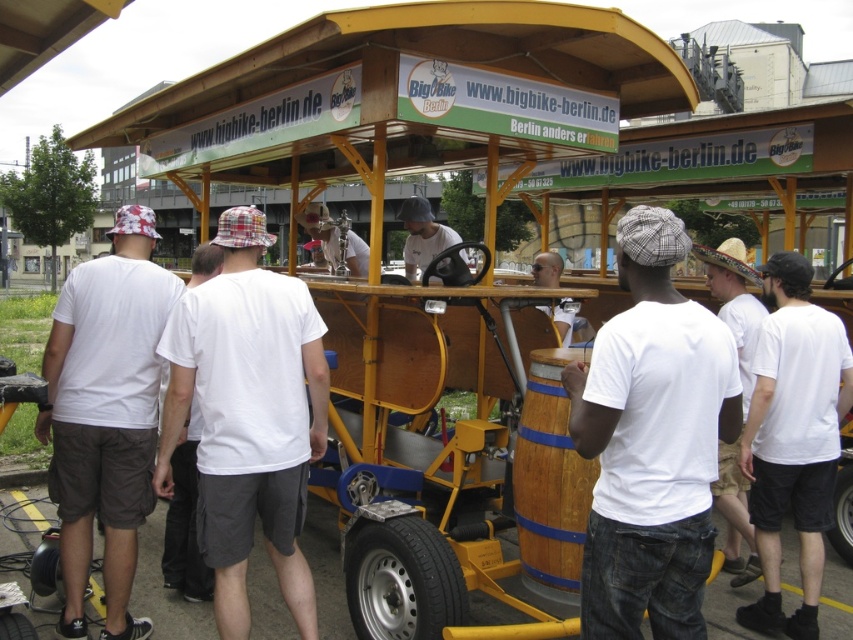
Question: Can you confirm if white matte shirt at center is thinner than white cotton shirt at left?

Choices:
 (A) yes
 (B) no

Answer: (B)

Question: Does white matte shirt at center appear over white cotton shirt at center?

Choices:
 (A) yes
 (B) no

Answer: (A)

Question: Can you confirm if white cotton t-shirt at center is positioned to the right of plaid fabric hat at center?

Choices:
 (A) yes
 (B) no

Answer: (B)

Question: Considering the real-world distances, which object is closest to the white cotton shirt at left?

Choices:
 (A) white cotton t-shirt at center
 (B) white matte shirt at center
 (C) white cotton shirt at center
 (D) matte black sunglasses at center

Answer: (A)

Question: Which object is the closest to the matte black sunglasses at center?

Choices:
 (A) white cotton t-shirt at center
 (B) white matte shirt at center

Answer: (A)

Question: Which point is closer to the camera?

Choices:
 (A) pos(746,605)
 (B) pos(549,269)
 (C) pos(172,520)

Answer: (A)